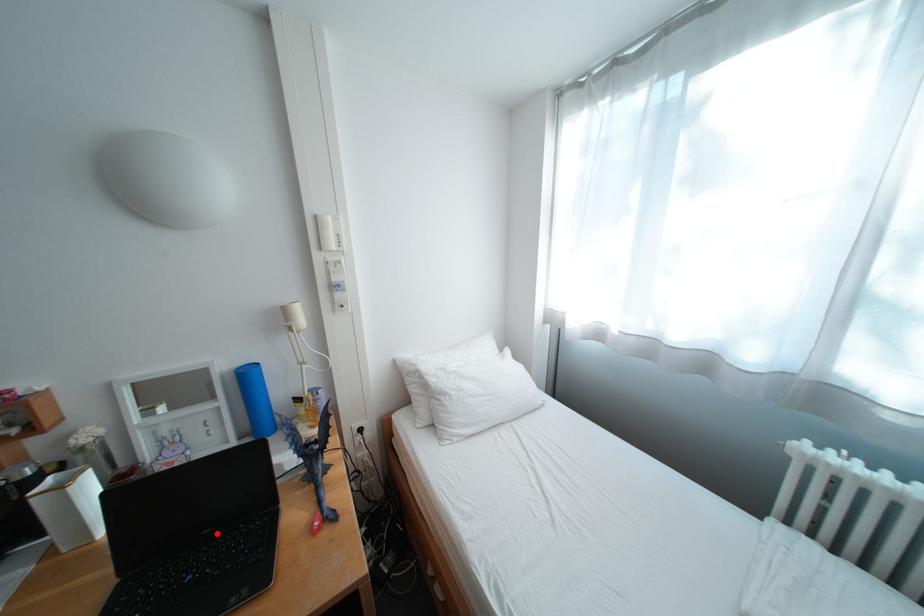
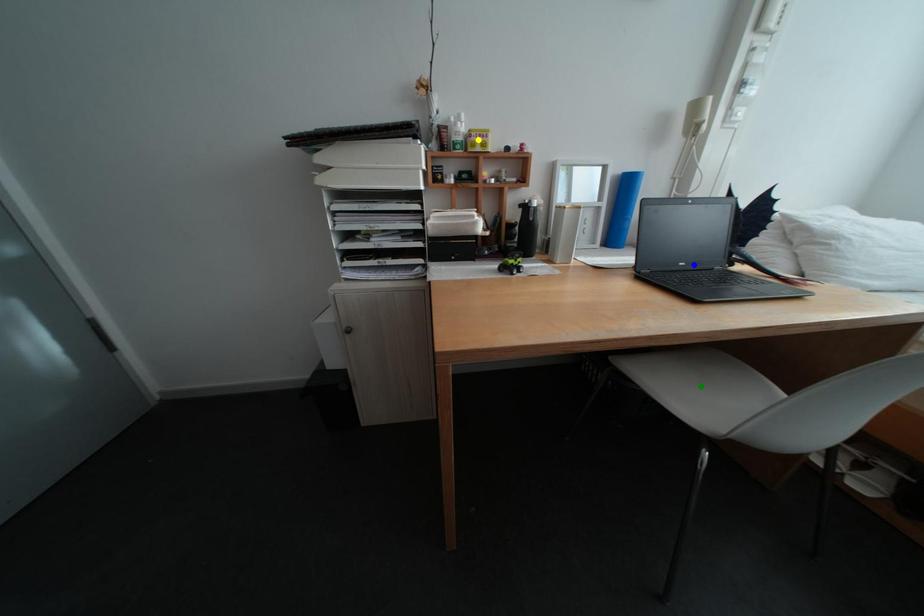
Question: I am providing you with two images of the same scene from different viewpoints. A red point is marked on the first image. You are given multiple points on the second image. Which point in image 2 represents the same 3d spot as the red point in image 1?

Choices:
 (A) yellow point
 (B) green point
 (C) blue point

Answer: (C)